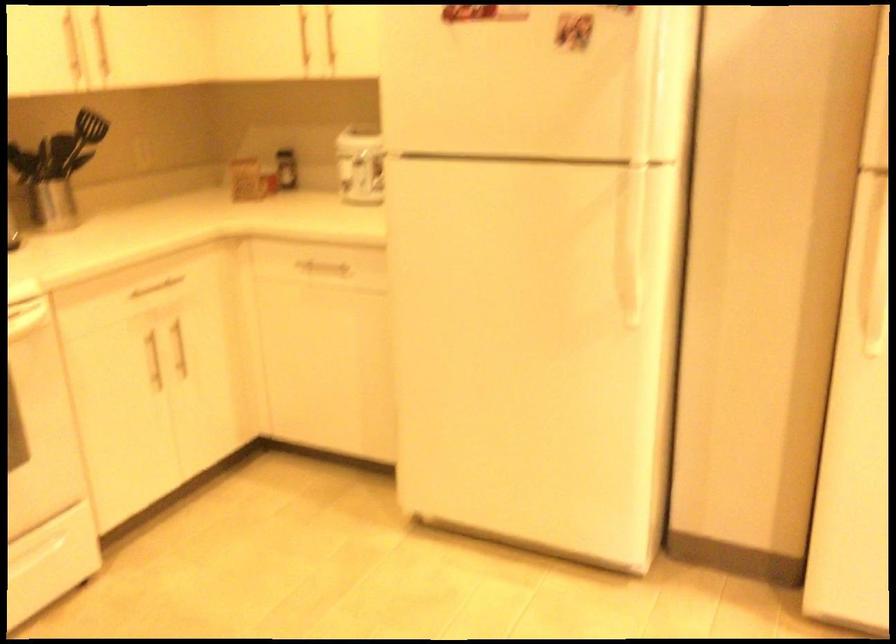
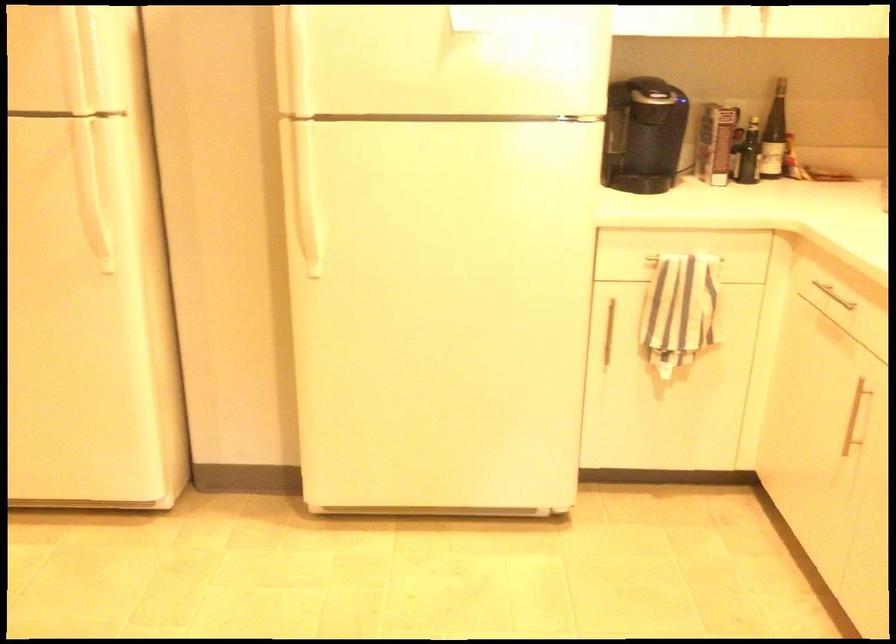
Which direction would the cameraman need to move to produce the second image?

The cameraman moved toward right, backward.